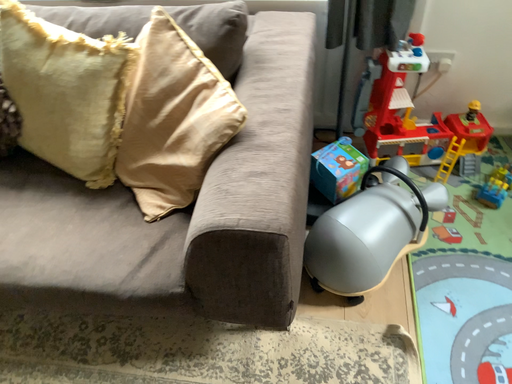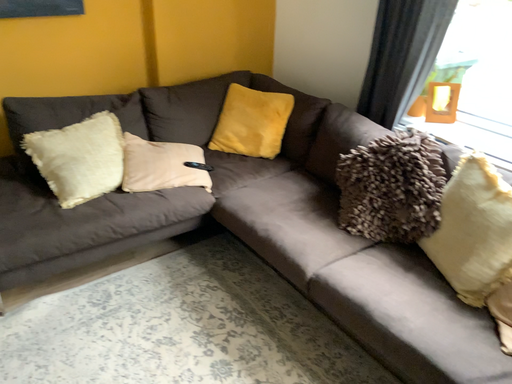
Question: Which way did the camera rotate in the video?

Choices:
 (A) rotated right
 (B) rotated left

Answer: (B)